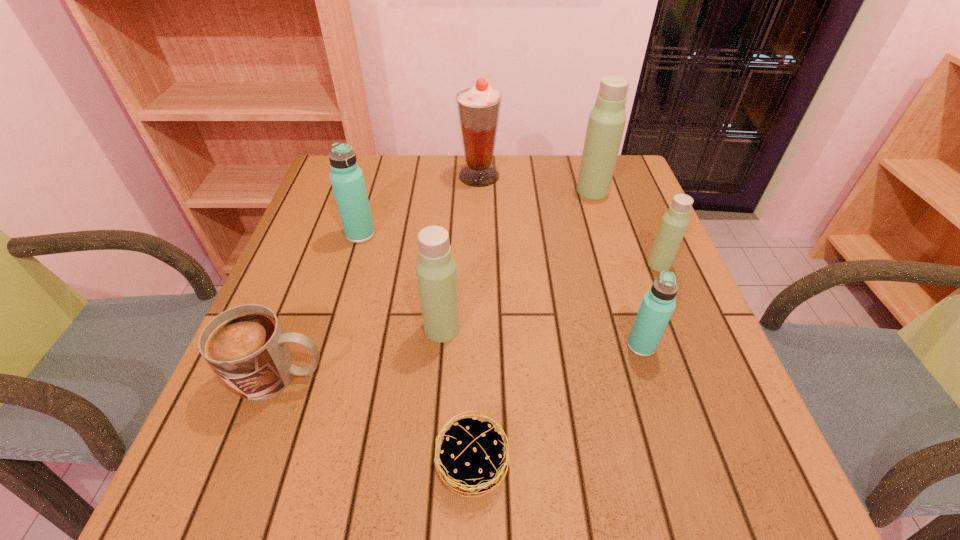
Where is `free location located on the side of the mug with the handle`? free location located on the side of the mug with the handle is located at coordinates (522, 377).

The height and width of the screenshot is (540, 960). Find the location of `vacant region located 0.350m on the back of the patty`. vacant region located 0.350m on the back of the patty is located at coordinates [475, 279].

Locate an element on the screen. thermos bottle that is at the far edge is located at coordinates (x=607, y=119).

Find the location of a particular element. The width and height of the screenshot is (960, 540). smoothie that is at the far edge is located at coordinates 479,107.

The height and width of the screenshot is (540, 960). Find the location of `object present at the near edge`. object present at the near edge is located at coordinates (471, 458).

This screenshot has height=540, width=960. I want to click on thermos bottle at the left edge, so click(x=347, y=180).

Identify the location of mug present at the left edge. (245, 346).

Locate an element on the screen. object located at the far right corner is located at coordinates (607, 119).

This screenshot has width=960, height=540. What are the coordinates of `vacant space at the far edge of the desktop` in the screenshot? It's located at (409, 171).

At what (x,y) coordinates should I click in order to perform the action: click on free spot at the near edge of the desktop. Please return your answer as a coordinate pair (x, y). This screenshot has width=960, height=540. Looking at the image, I should click on (634, 452).